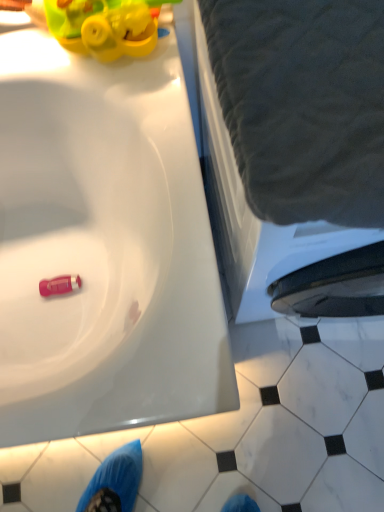
Locate an element on the screen. The image size is (384, 512). free space on the front side of gray fabric at upper right is located at coordinates (301, 416).